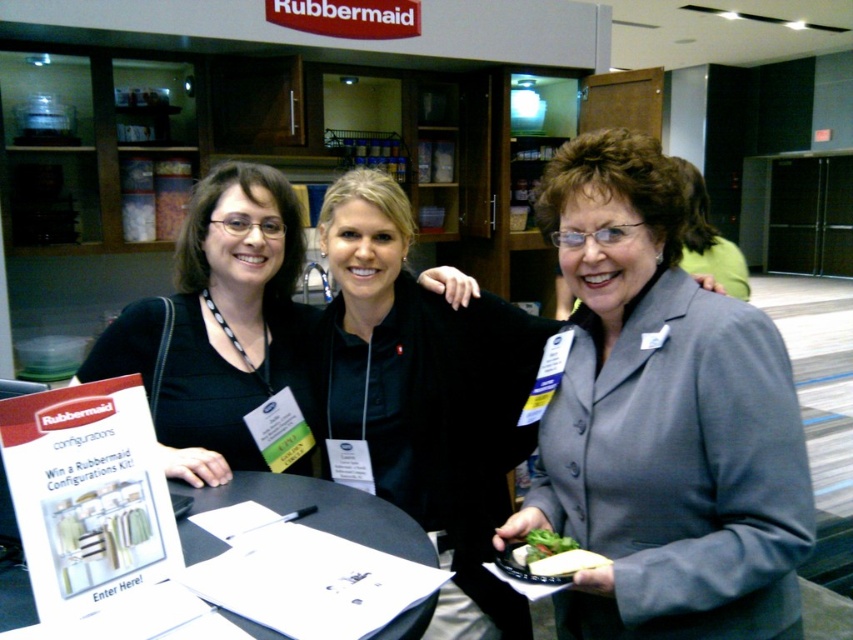
You are a visitor at the trade show and want to know which object is taller between the black fabric shirt at upper left and the black plastic table at center. Can you tell me?

The black fabric shirt at upper left is taller than the black plastic table at center.

You are a photographer at the event and need to take a photo of the gray matte blazer at center and the green leafy salad at center. Which object should you focus on first if you want to capture both in one shot without moving the camera?

You should focus on the gray matte blazer at center first because it is larger than the green leafy salad at center, ensuring it remains in focus while the smaller salad may still be within the depth of field.